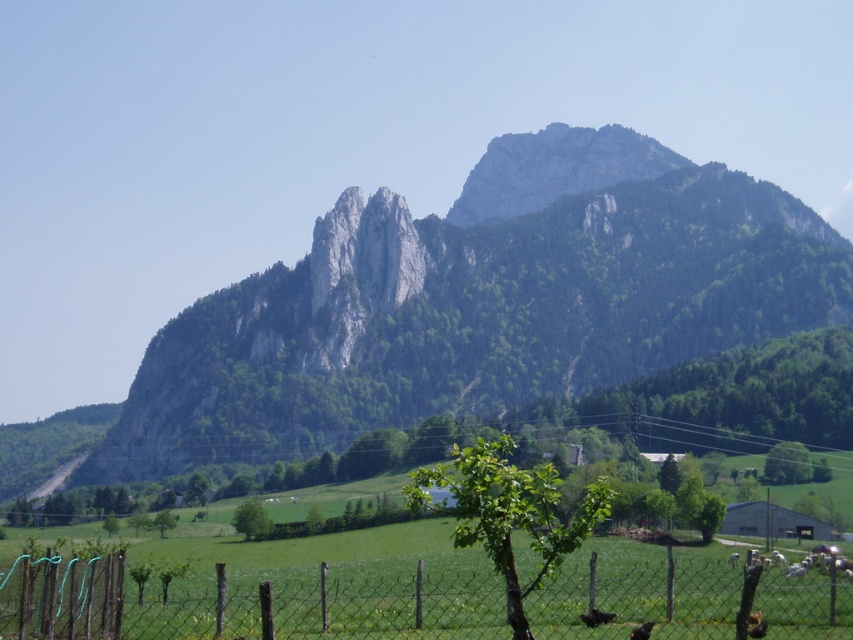
Question: Is green rocky mountain at center positioned behind wire mesh fence at lower center?

Choices:
 (A) yes
 (B) no

Answer: (A)

Question: Among these points, which one is farthest from the camera?

Choices:
 (A) tap(553, 156)
 (B) tap(68, 570)

Answer: (A)

Question: Which object is farther from the camera taking this photo?

Choices:
 (A) green rocky mountain at center
 (B) wire mesh fence at lower center

Answer: (A)

Question: Considering the relative positions of green rocky mountain at center and wire mesh fence at lower center in the image provided, where is green rocky mountain at center located with respect to wire mesh fence at lower center?

Choices:
 (A) below
 (B) above

Answer: (B)

Question: Where is green rocky mountain at center located in relation to wire mesh fence at lower center in the image?

Choices:
 (A) below
 (B) above

Answer: (B)